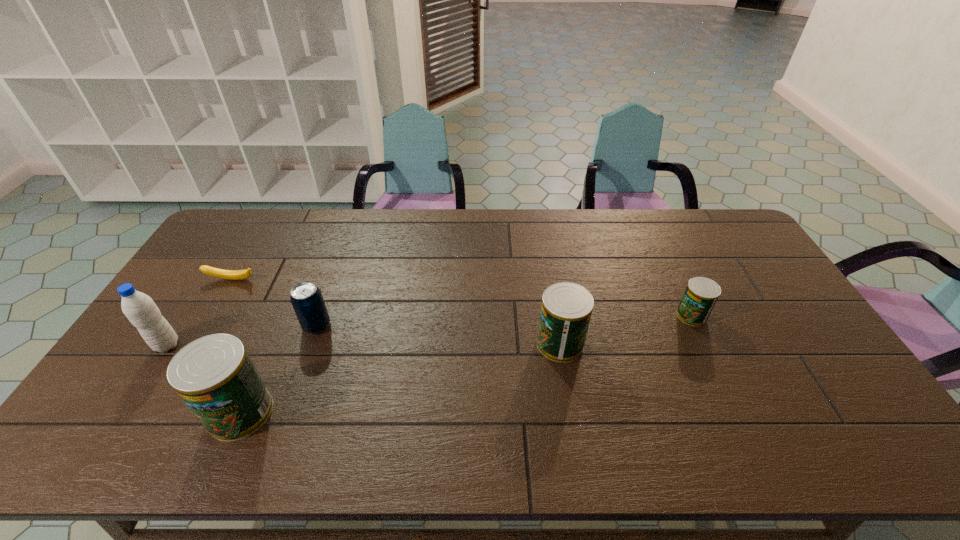
Please mark a free spot for a new can to balance the arrangement. Please provide its 2D coordinates. Your answer should be formatted as a tuple, i.e. [(x, y)], where the tuple contains the x and y coordinates of a point satisfying the conditions above.

[(411, 376)]